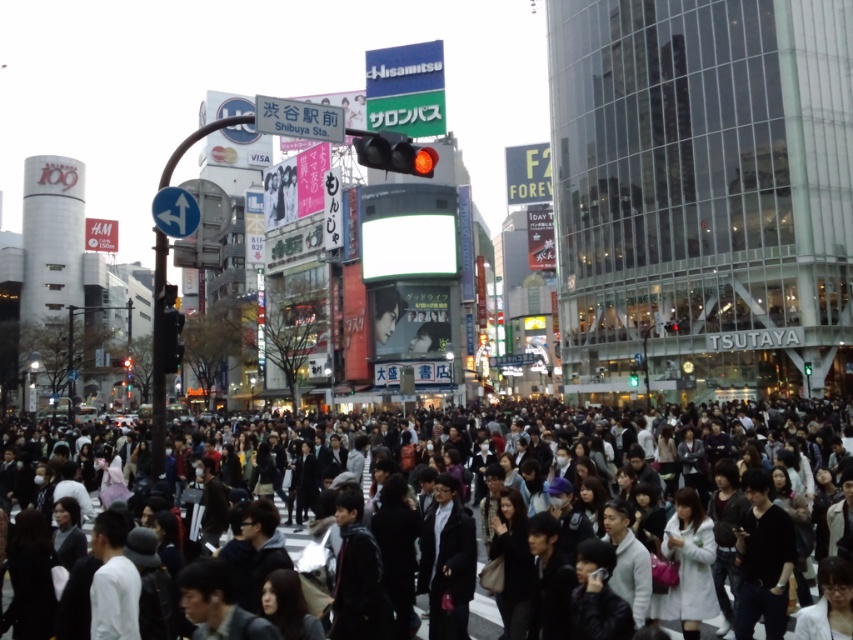
From the picture: Does black fabric jacket at center have a smaller size compared to black fabric bag at center?

No.

From the picture: Does black fabric jacket at center appear on the left side of black fabric bag at center?

Yes, black fabric jacket at center is to the left of black fabric bag at center.

The height and width of the screenshot is (640, 853). Find the location of `black fabric jacket at center`. black fabric jacket at center is located at coordinates (x=447, y=561).

You are a GUI agent. You are given a task and a screenshot of the screen. Output one action in this format:
    pyautogui.click(x=<x>, y=<y>)
    Task: Click on the black fabric jacket at center
    
    Given the screenshot: What is the action you would take?
    pyautogui.click(x=447, y=561)

Can you confirm if dark gray clothing at center is wider than gray sweater at center?

Yes.

Between dark gray clothing at center and gray sweater at center, which one appears on the right side from the viewer's perspective?

gray sweater at center

What do you see at coordinates (767, 428) in the screenshot?
I see `dark gray clothing at center` at bounding box center [767, 428].

The image size is (853, 640). In order to click on dark gray clothing at center in this screenshot , I will do `click(767, 428)`.

Does dark gray coat at lower left have a smaller size compared to dark gray suit at center?

Correct, dark gray coat at lower left occupies less space than dark gray suit at center.

Does point (13, 634) lie behind point (293, 470)?

That is False.

Locate an element on the screen. This screenshot has height=640, width=853. dark gray coat at lower left is located at coordinates (30, 579).